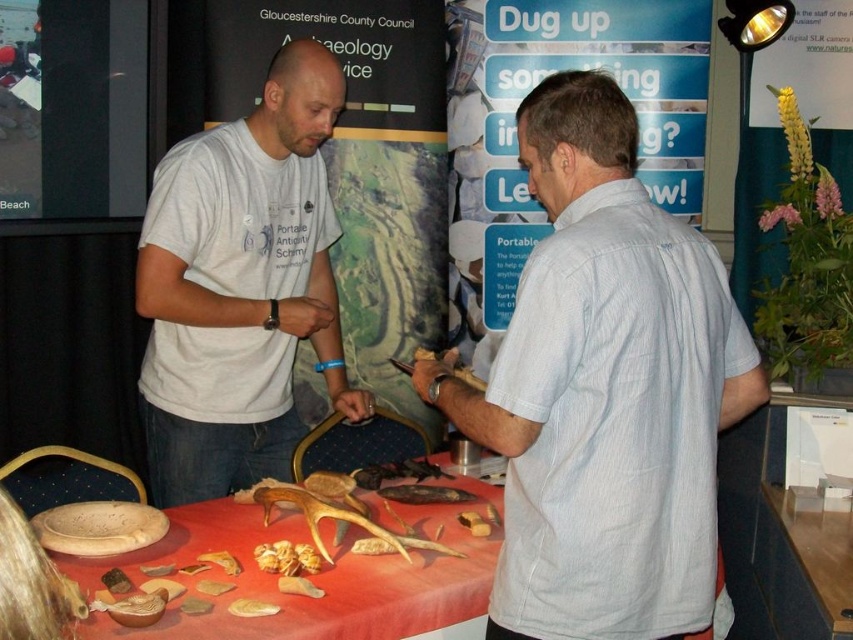
Is white striped shirt at right closer to camera compared to matte red tablecloth at center?

Yes, white striped shirt at right is in front of matte red tablecloth at center.

Is white striped shirt at right further to the viewer compared to matte red tablecloth at center?

That is False.

Where is `white striped shirt at right`? white striped shirt at right is located at coordinates (604, 390).

Which of these two, white striped shirt at right or golden textured seeds at center, stands shorter?

golden textured seeds at center

What do you see at coordinates (604, 390) in the screenshot? I see `white striped shirt at right` at bounding box center [604, 390].

Identify the location of white striped shirt at right. (604, 390).

Is matte red tablecloth at center below brown wooden fish at center?

Yes, matte red tablecloth at center is below brown wooden fish at center.

Who is shorter, matte red tablecloth at center or brown wooden fish at center?

With less height is brown wooden fish at center.

Where is `matte red tablecloth at center`? This screenshot has height=640, width=853. matte red tablecloth at center is located at coordinates (310, 573).